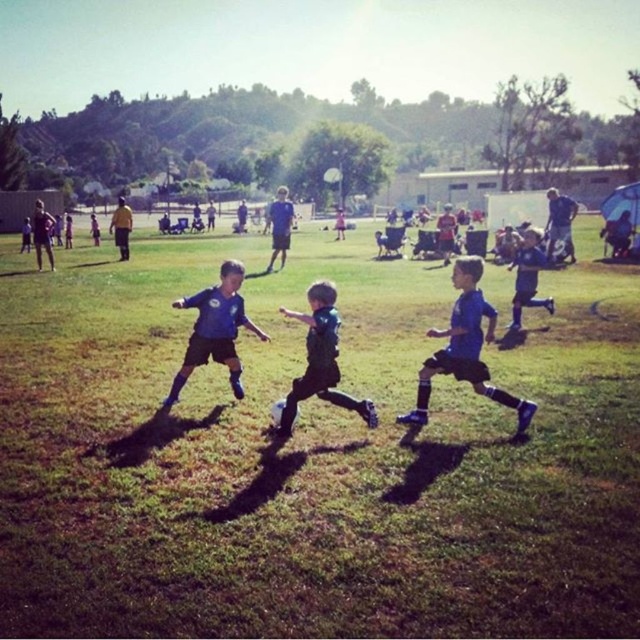
Question: Among these objects, which one is farthest from the camera?

Choices:
 (A) blue matte soccer jersey at right
 (B) green grass soccer field at center

Answer: (A)

Question: Among these points, which one is farthest from the camera?

Choices:
 (A) (328, 289)
 (B) (97, 477)

Answer: (A)

Question: Can you confirm if green grass soccer field at center is positioned below blue matte soccer player at center?

Choices:
 (A) no
 (B) yes

Answer: (A)

Question: Is green grass soccer field at center below dark blue jersey at center?

Choices:
 (A) no
 (B) yes

Answer: (A)

Question: Which of the following is the closest to the observer?

Choices:
 (A) (211, 336)
 (B) (486, 310)
 (C) (540, 244)

Answer: (B)

Question: Is green grass soccer field at center positioned behind blue jersey at center?

Choices:
 (A) no
 (B) yes

Answer: (A)